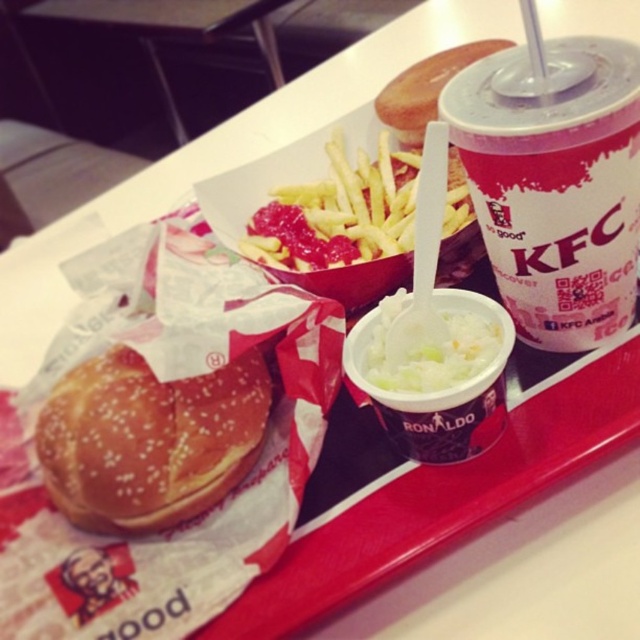
Is point (161, 529) behind point (416, 381)?

That is True.

Is point (64, 458) closer to camera compared to point (433, 356)?

That is True.

Locate an element on the screen. slightly toasted bun at center-left is located at coordinates (148, 440).

Between point (500, 145) and point (116, 461), which one is positioned in front?

Point (500, 145) is more forward.

This screenshot has width=640, height=640. I want to click on white paper cup with straw at upper right, so click(554, 182).

You are a GUI agent. You are given a task and a screenshot of the screen. Output one action in this format:
    pyautogui.click(x=<x>, y=<y>)
    Task: Click on the white paper cup with straw at upper right
    
    Given the screenshot: What is the action you would take?
    pyautogui.click(x=554, y=182)

Between slightly toasted bun at center-left and yellow crispy french fries at center, which one appears on the right side from the viewer's perspective?

yellow crispy french fries at center

Find the location of `slightly toasted bun at center-left`. slightly toasted bun at center-left is located at coordinates (148, 440).

At what (x,y) coordinates should I click in order to perform the action: click on slightly toasted bun at center-left. Please return your answer as a coordinate pair (x, y). The width and height of the screenshot is (640, 640). Looking at the image, I should click on (148, 440).